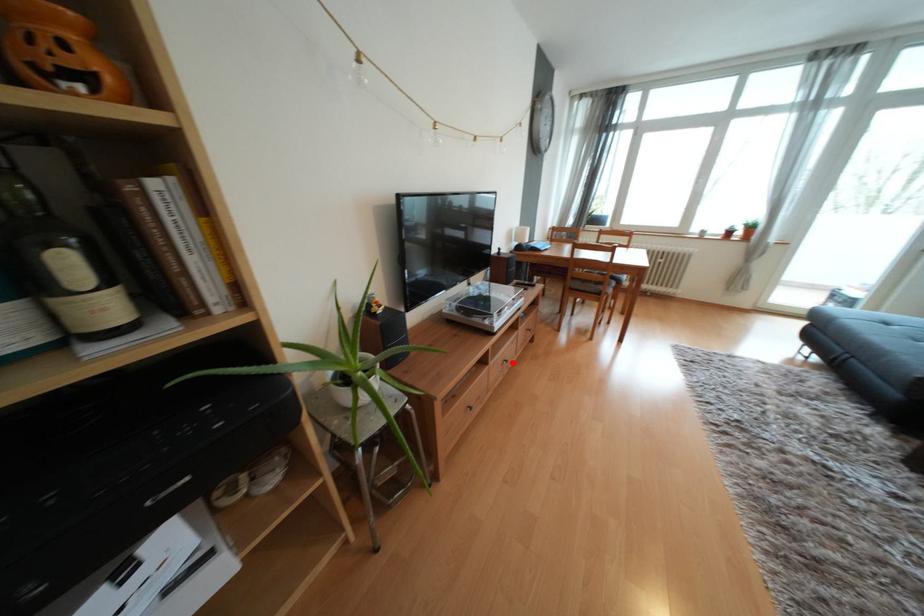
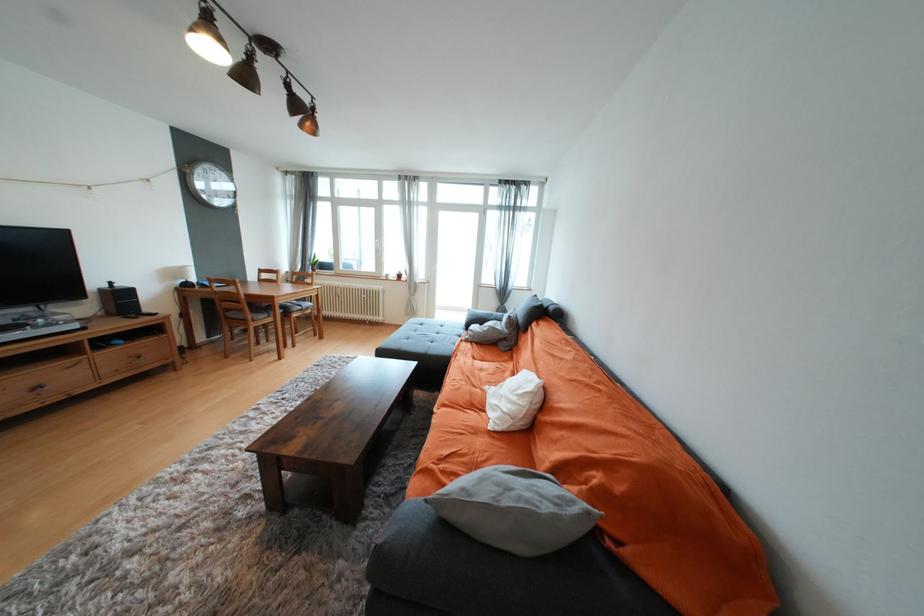
Locate, in the second image, the point that corresponds to the highlighted location in the first image.

(44, 387)